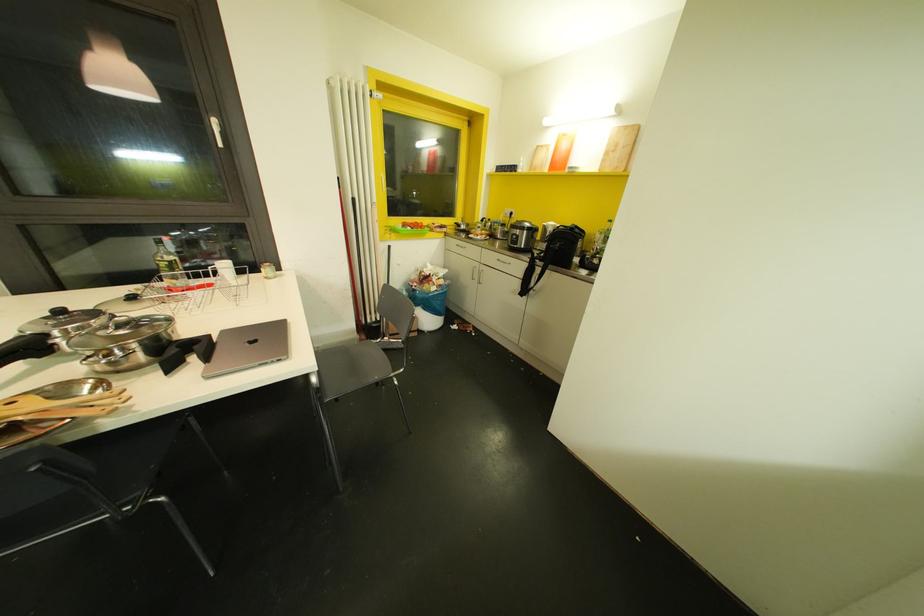
Describe the element at coordinates (248, 347) in the screenshot. The width and height of the screenshot is (924, 616). I see `a grey laptop` at that location.